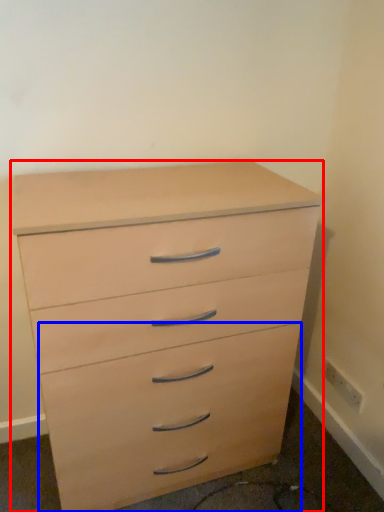
Question: Which object appears closest to the camera in this image, chest of drawers (highlighted by a red box) or drawer (highlighted by a blue box)?

Choices:
 (A) chest of drawers
 (B) drawer

Answer: (A)